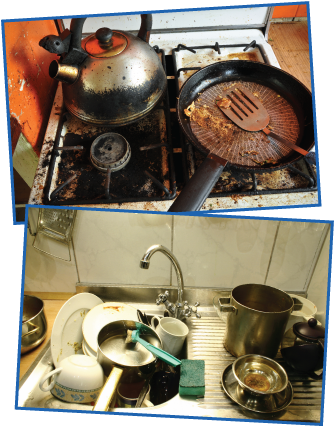
Locate an element on the screen. flipper in dirty frying pan is located at coordinates (257, 117).